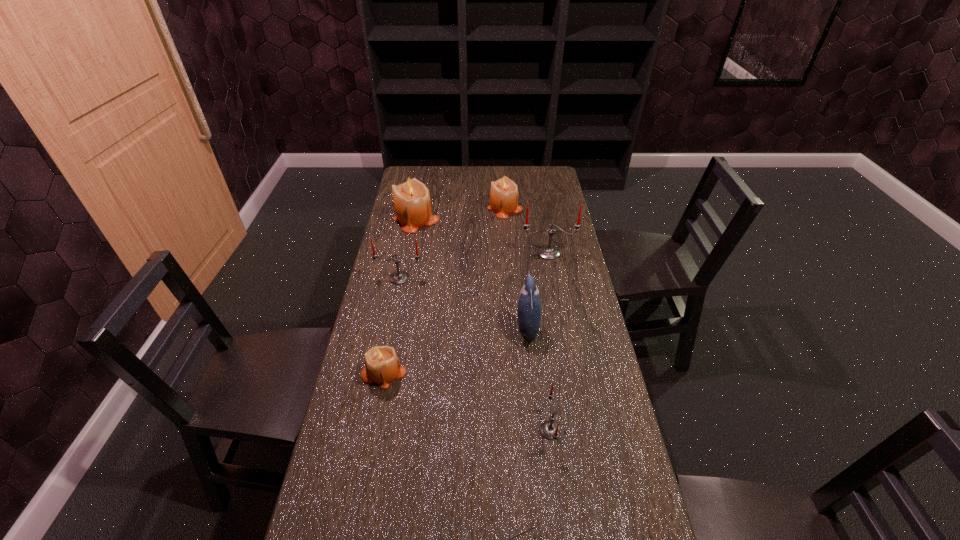
At what (x,y) coordinates should I click in order to perform the action: click on the sixth farthest object. Please return your answer as a coordinate pair (x, y). The width and height of the screenshot is (960, 540). Looking at the image, I should click on (382, 365).

Image resolution: width=960 pixels, height=540 pixels. I want to click on the smallest beige candle, so click(x=382, y=365).

Find the location of a particular element. This screenshot has width=960, height=540. free space located 0.400m on the front-facing side of the sixth nearest object is located at coordinates (564, 342).

Find the location of `vacant space positioned 0.170m on the right of the biggest beige candle`. vacant space positioned 0.170m on the right of the biggest beige candle is located at coordinates (479, 218).

Image resolution: width=960 pixels, height=540 pixels. I want to click on free spot located at the tip of the fourth nearest object's beak, so click(404, 328).

Find the location of `free region located 0.280m at the tip of the fourth nearest object's beak`. free region located 0.280m at the tip of the fourth nearest object's beak is located at coordinates (429, 328).

Identify the location of free space located 0.150m at the tip of the fourth nearest object's beak. (469, 328).

The width and height of the screenshot is (960, 540). I want to click on free space located 0.280m on the front-facing side of the third nearest candle, so click(x=386, y=346).

Where is `vacant space located on the front of the second biggest beige candle`? The height and width of the screenshot is (540, 960). vacant space located on the front of the second biggest beige candle is located at coordinates (509, 258).

The image size is (960, 540). I want to click on vacant position located 0.220m on the front-facing side of the nearest red candle, so click(x=456, y=430).